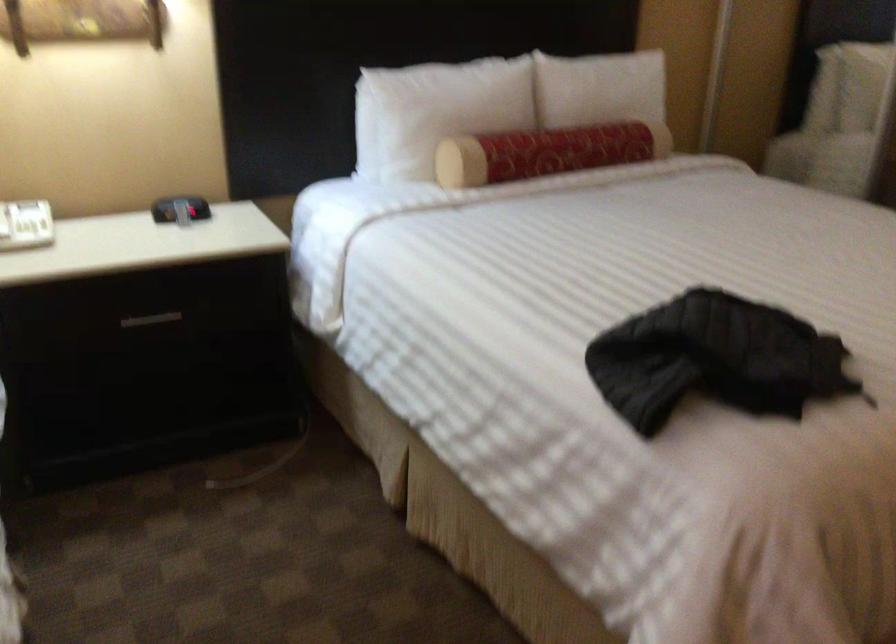
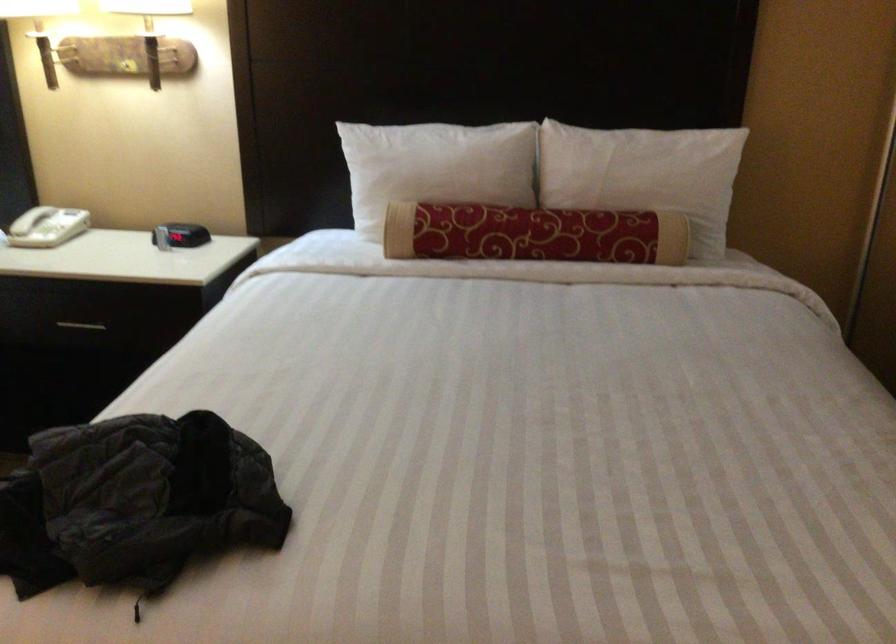
In the second image, find the point that corresponds to pixel 631 88 in the first image.

(643, 174)